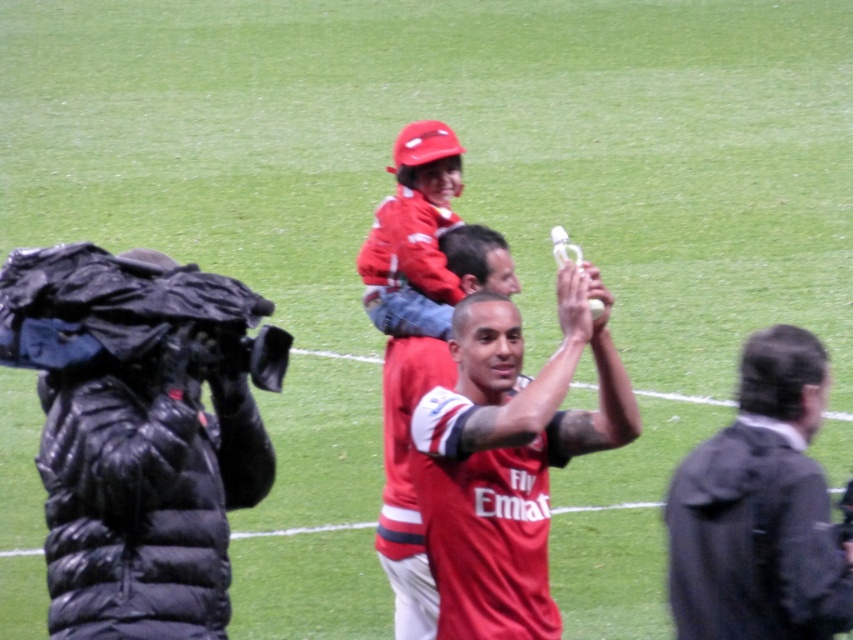
Can you confirm if red jersey at center is positioned to the right of matte red jersey at center?

Indeed, red jersey at center is positioned on the right side of matte red jersey at center.

Who is shorter, red jersey at center or matte red jersey at center?

With less height is matte red jersey at center.

Is point (489, 634) in front of point (409, 520)?

Yes, point (489, 634) is in front of point (409, 520).

The image size is (853, 640). I want to click on red jersey at center, so click(x=508, y=458).

Which is below, black puffer jacket at left or dark gray jacket at right?

dark gray jacket at right is lower down.

Who is higher up, black puffer jacket at left or dark gray jacket at right?

Positioned higher is black puffer jacket at left.

Is point (141, 492) positioned after point (693, 582)?

No, (141, 492) is in front of (693, 582).

Locate an element on the screen. The width and height of the screenshot is (853, 640). black puffer jacket at left is located at coordinates (149, 474).

Does black puffer jacket at left lie in front of matte red jersey at center?

Yes, it is.

Can you confirm if black puffer jacket at left is thinner than matte red jersey at center?

No, black puffer jacket at left is not thinner than matte red jersey at center.

The width and height of the screenshot is (853, 640). Find the location of `black puffer jacket at left`. black puffer jacket at left is located at coordinates (149, 474).

You are a GUI agent. You are given a task and a screenshot of the screen. Output one action in this format:
    pyautogui.click(x=<x>, y=<y>)
    Task: Click on the black puffer jacket at left
    The width and height of the screenshot is (853, 640).
    Given the screenshot: What is the action you would take?
    pyautogui.click(x=149, y=474)